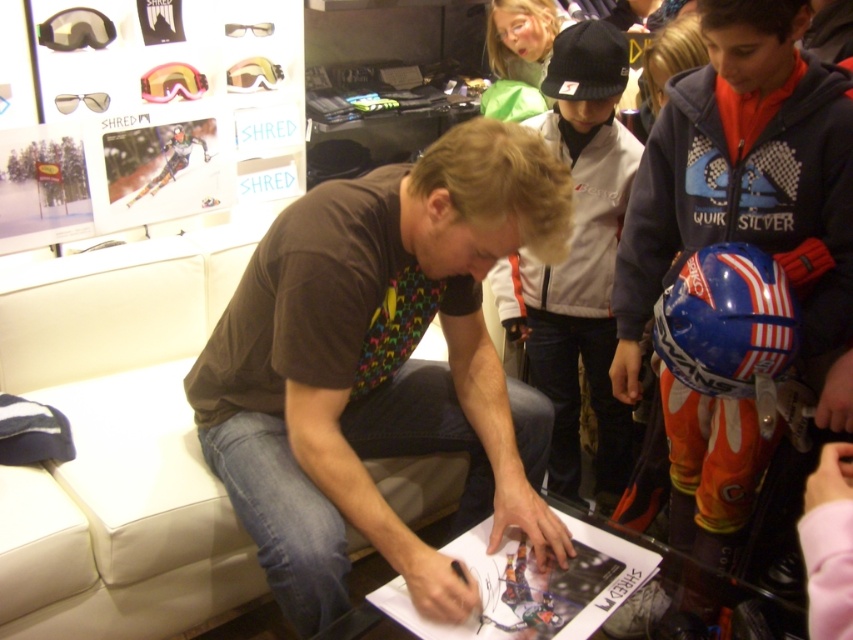
This screenshot has width=853, height=640. I want to click on brownmaterial shirt at center, so click(381, 365).

Is brownmaterial shirt at center further to the viewer compared to black glossy pen at center?

No, it is in front of black glossy pen at center.

Does point (283, 333) come farther from viewer compared to point (624, 576)?

No, (283, 333) is closer to viewer.

Where is `brownmaterial shirt at center`? The width and height of the screenshot is (853, 640). brownmaterial shirt at center is located at coordinates (381, 365).

Is brownmaterial shirt at center shorter than matte black poster at upper left?

No.

Is point (338, 600) farther from camera compared to point (134, 216)?

No, (338, 600) is in front of (134, 216).

Image resolution: width=853 pixels, height=640 pixels. Identify the location of brownmaterial shirt at center. (381, 365).

Is point (235, 552) more distant than point (610, 609)?

Yes, point (235, 552) is farther from viewer.

Where is `white leather couch at center`? The image size is (853, 640). white leather couch at center is located at coordinates (119, 444).